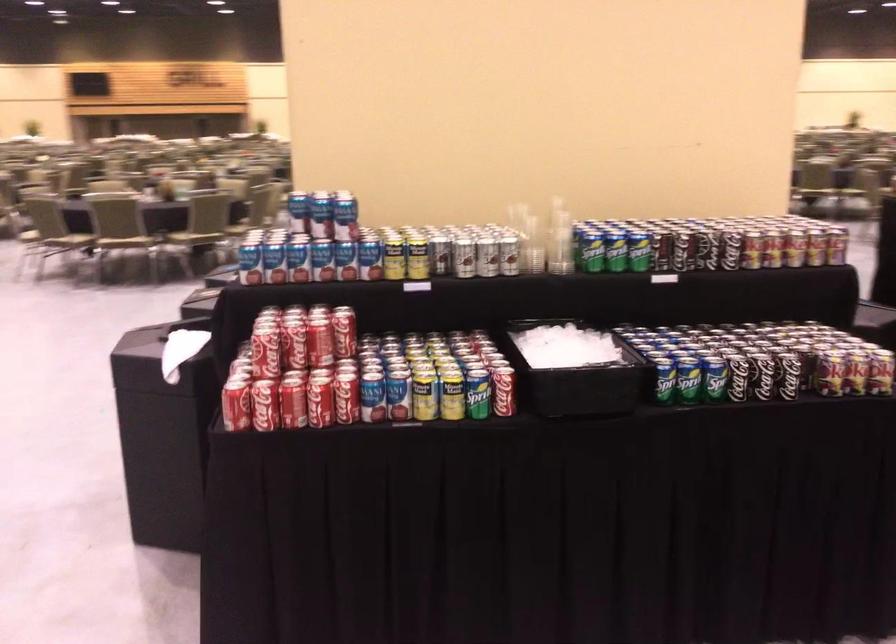
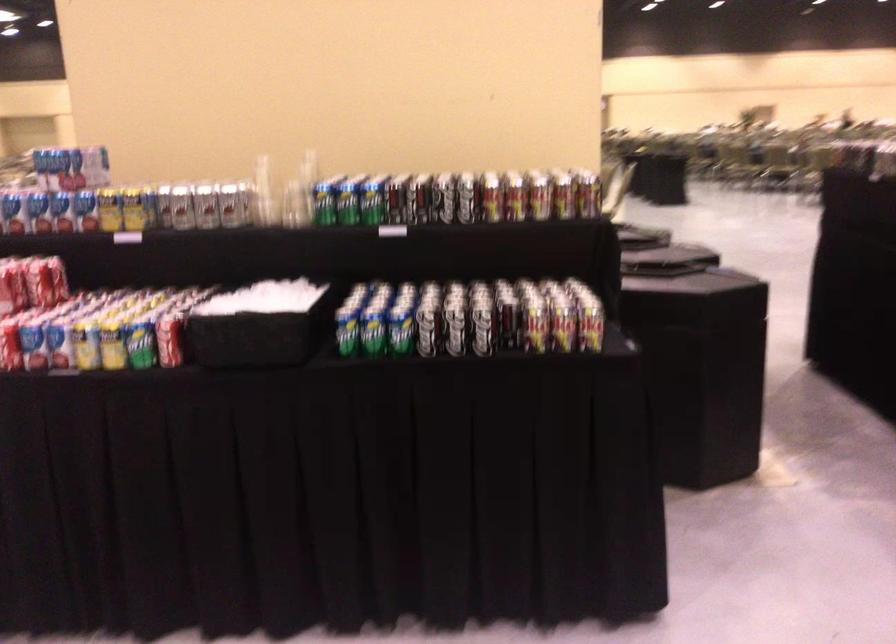
Find the pixel in the second image that matches (x=340, y=402) in the first image.

(10, 346)